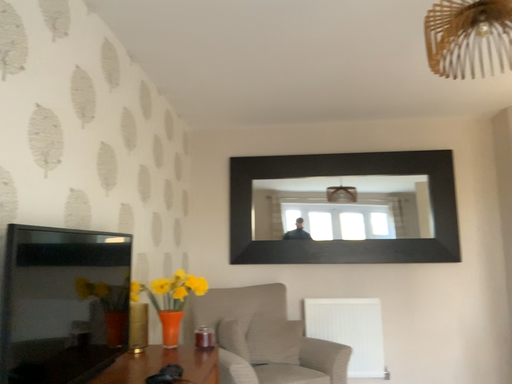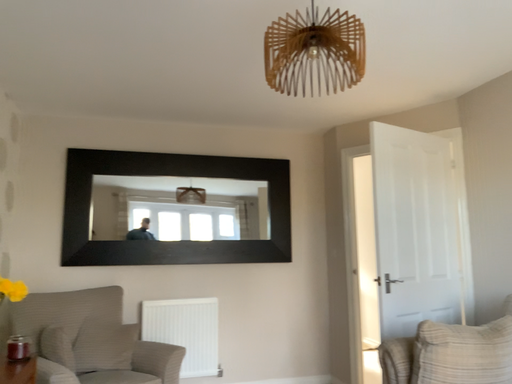
Question: Which way did the camera rotate in the video?

Choices:
 (A) rotated left
 (B) rotated right

Answer: (B)